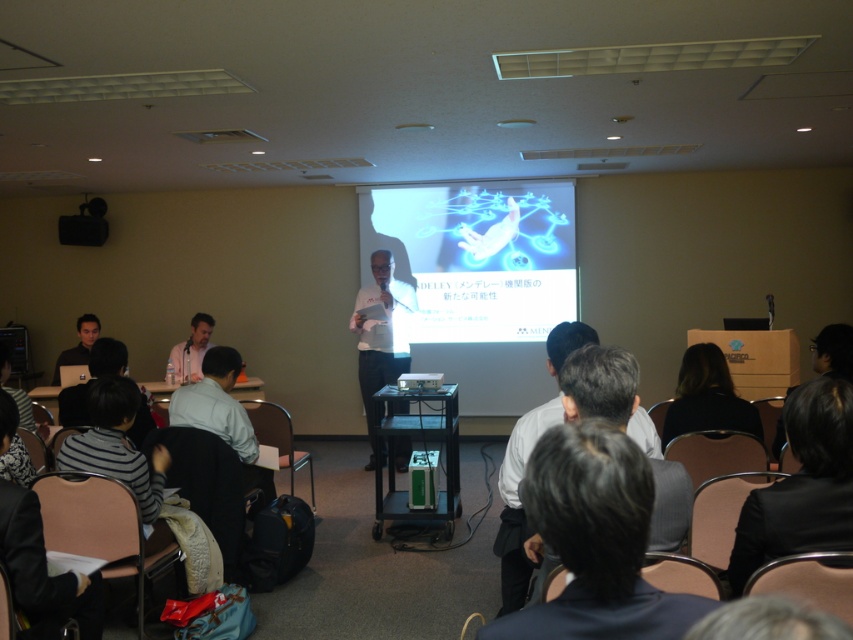
Question: Which object is positioned farthest from the black glossy box at lower right?

Choices:
 (A) matte black speaker at lower left
 (B) white matte shirt at center
 (C) white shirt at center
 (D) black hair at lower right

Answer: (A)

Question: Which point appears closest to the camera in this image?

Choices:
 (A) (234, 422)
 (B) (547, 192)
 (C) (59, 378)
 (D) (554, 397)

Answer: (A)

Question: Is white matte shirt at center below black hair at lower right?

Choices:
 (A) no
 (B) yes

Answer: (A)

Question: Among these objects, which one is nearest to the camera?

Choices:
 (A) matte black laptop at lower left
 (B) dark gray suit at center
 (C) black plastic projector at center
 (D) black hair at lower right

Answer: (B)

Question: Does white matte shirt at center have a lesser width compared to black hair at lower right?

Choices:
 (A) no
 (B) yes

Answer: (A)

Question: Where is white matte shirt at center located in relation to matte black speaker at lower left in the image?

Choices:
 (A) left
 (B) right

Answer: (B)